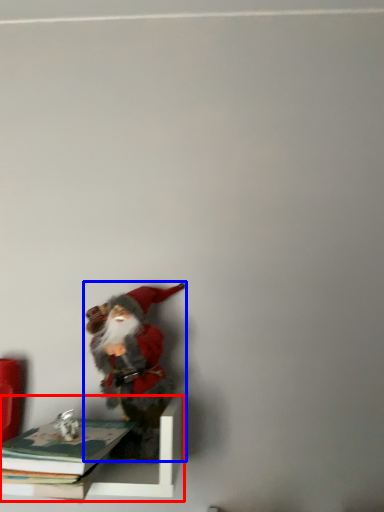
Question: Which object appears closest to the camera in this image, shelf (highlighted by a red box) or person (highlighted by a blue box)?

Choices:
 (A) shelf
 (B) person

Answer: (A)